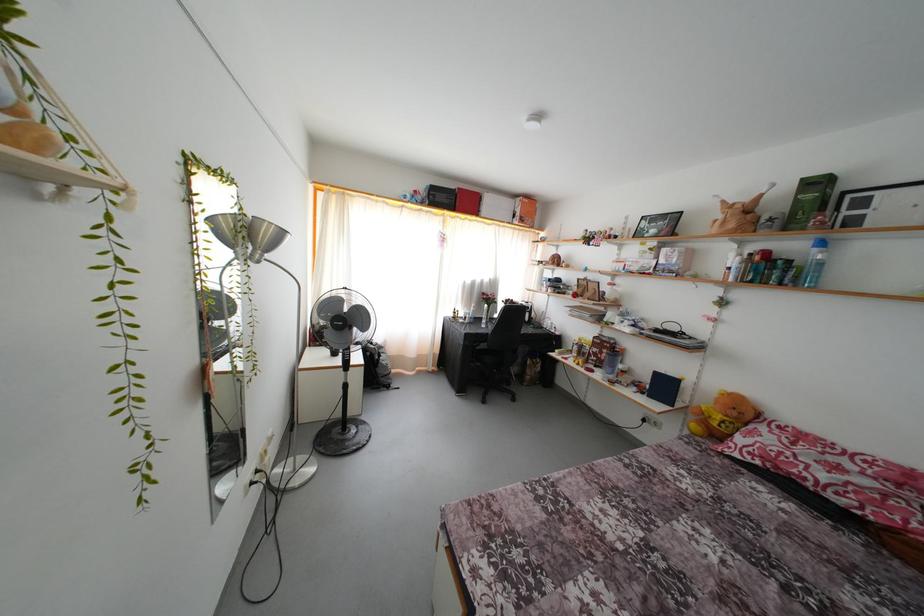
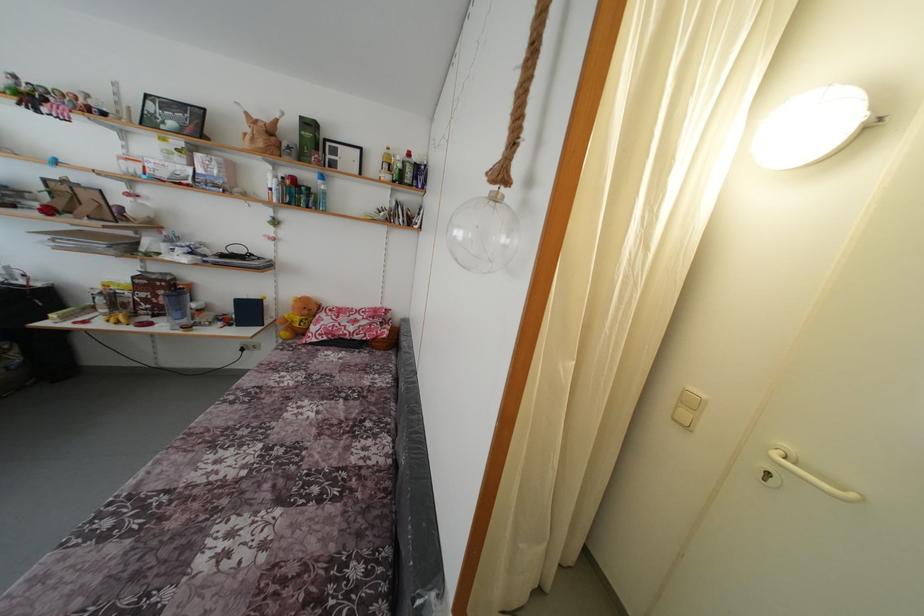
In the second image, find the point that corresponds to point 775,438 in the first image.

(332, 321)